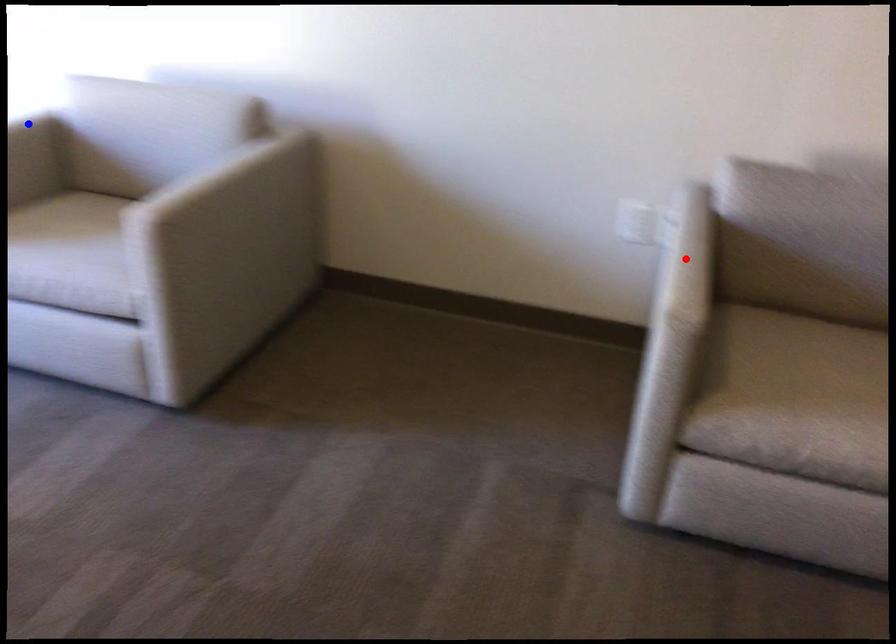
Question: Which of the two points in the image is closer to the camera?

Choices:
 (A) Blue point is closer.
 (B) Red point is closer.

Answer: (B)